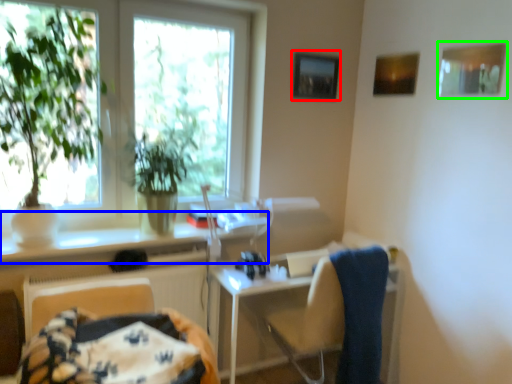
Question: Based on their relative distances, which object is farther from picture frame (highlighted by a red box)? Choose from counter top (highlighted by a blue box) and picture frame (highlighted by a green box).

Choices:
 (A) counter top
 (B) picture frame

Answer: (A)